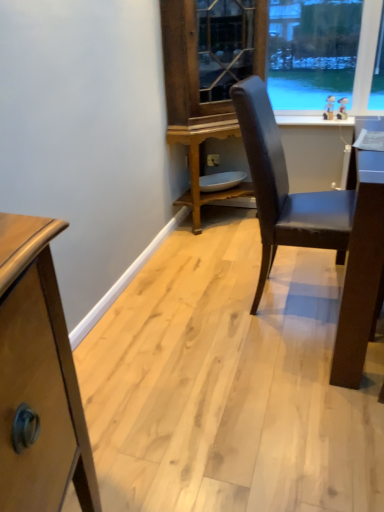
Where is `vacant space underneath matte black chair at center (from a real-world perspective)`? The width and height of the screenshot is (384, 512). vacant space underneath matte black chair at center (from a real-world perspective) is located at coordinates (306, 308).